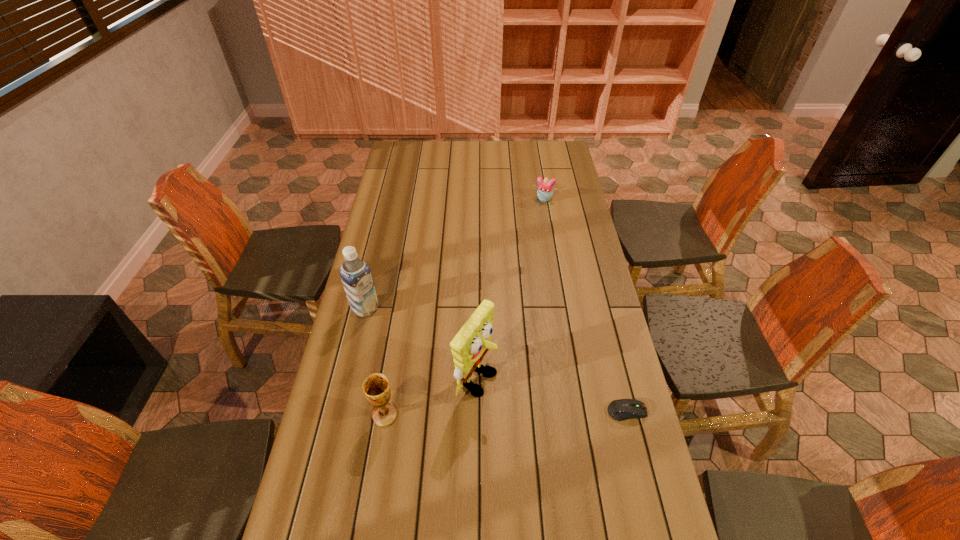
Where is `soya milk located at the left edge`? The width and height of the screenshot is (960, 540). soya milk located at the left edge is located at coordinates (355, 274).

Where is `computer equipment positioned at the right edge`? The image size is (960, 540). computer equipment positioned at the right edge is located at coordinates (623, 409).

Where is `cupcake that is positioned at the right edge`? The width and height of the screenshot is (960, 540). cupcake that is positioned at the right edge is located at coordinates (545, 190).

I want to click on vacant space at the far edge, so click(513, 161).

What are the coordinates of `vacant point at the left edge` in the screenshot? It's located at (394, 310).

At what (x,y) coordinates should I click in order to perform the action: click on vacant space at the right edge of the desktop. Please return your answer as a coordinate pair (x, y). Image resolution: width=960 pixels, height=540 pixels. Looking at the image, I should click on (588, 395).

Where is `unoccupied position between the rightmost object and the second farthest object`? The width and height of the screenshot is (960, 540). unoccupied position between the rightmost object and the second farthest object is located at coordinates (496, 360).

Locate an element on the screen. The height and width of the screenshot is (540, 960). free space between the farthest object and the sponge is located at coordinates (510, 288).

Locate an element on the screen. The image size is (960, 540). vacant area that lies between the third object from right to left and the computer equipment is located at coordinates (551, 395).

The height and width of the screenshot is (540, 960). I want to click on free space between the third object from right to left and the third shortest object, so click(430, 396).